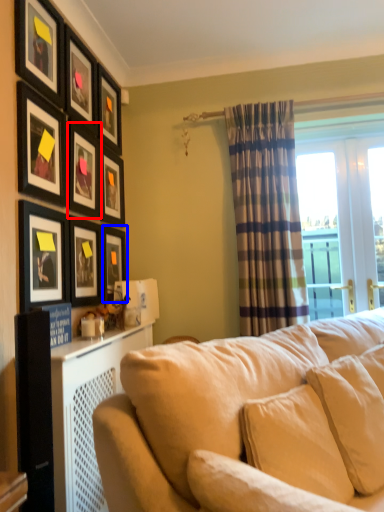
Question: Among these objects, which one is farthest to the camera, picture frame (highlighted by a red box) or picture frame (highlighted by a blue box)?

Choices:
 (A) picture frame
 (B) picture frame

Answer: (B)